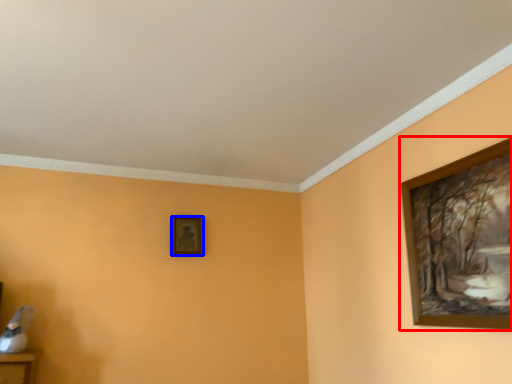
Question: Which object is further to the camera taking this photo, picture frame (highlighted by a red box) or picture frame (highlighted by a blue box)?

Choices:
 (A) picture frame
 (B) picture frame

Answer: (B)